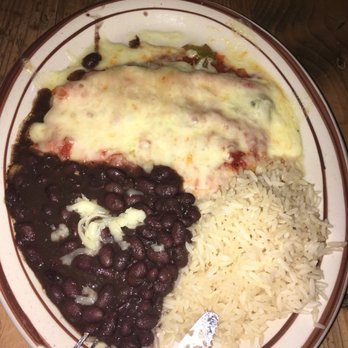
At what (x,y) coordinates should I click in order to perform the action: click on table. Please return your answer as a coordinate pair (x, y). Looking at the image, I should click on (309, 37).